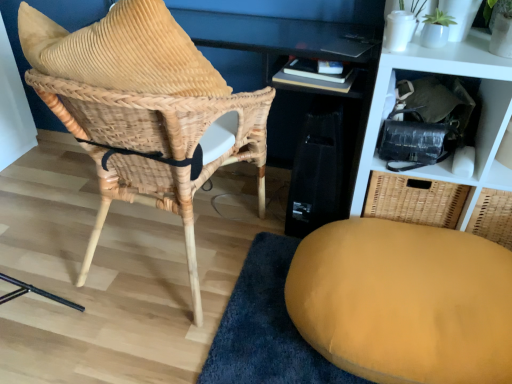
This screenshot has width=512, height=384. What are the coordinates of `woven wicker basket at upper right` in the screenshot? It's located at (479, 121).

What do you see at coordinates (145, 111) in the screenshot? I see `woven rattan chair at left` at bounding box center [145, 111].

Find the location of a particular element. velvet yellow ottoman at lower right is located at coordinates (404, 302).

Which object is further away from the camera, woven rattan chair at left or velvet yellow ottoman at lower right?

velvet yellow ottoman at lower right.

Identify the location of swivel chair below the woven rattan chair at left (from the image's perspective). The width and height of the screenshot is (512, 384). (404, 302).

Is point (91, 258) less distant than point (487, 253)?

No, it is not.

From a real-world perspective, is woven rattan chair at left over velvet yellow ottoman at lower right?

Correct, in the physical world, woven rattan chair at left is higher than velvet yellow ottoman at lower right.

From a real-world perspective, is velvet yellow ottoman at lower right under woven rattan chair at left?

Indeed, from a real-world perspective, velvet yellow ottoman at lower right is positioned beneath woven rattan chair at left.

Does velvet yellow ottoman at lower right appear on the left side of woven rattan chair at left?

Incorrect, velvet yellow ottoman at lower right is not on the left side of woven rattan chair at left.

From the picture: What's the angular difference between velvet yellow ottoman at lower right and woven rattan chair at left's facing directions?

There is a 97.7-degree angle between the facing directions of velvet yellow ottoman at lower right and woven rattan chair at left.

Are velvet yellow ottoman at lower right and woven rattan chair at left far apart?

Actually, velvet yellow ottoman at lower right and woven rattan chair at left are a little close together.

Is woven wicker basket at upper right with woven rattan chair at left?

No, woven wicker basket at upper right is not making contact with woven rattan chair at left.

Can you confirm if woven wicker basket at upper right is positioned to the left of woven rattan chair at left?

In fact, woven wicker basket at upper right is to the right of woven rattan chair at left.

Which of these two, woven wicker basket at upper right or woven rattan chair at left, is wider?

woven rattan chair at left.

Consider the image. Which of these two, woven wicker basket at upper right or woven rattan chair at left, is bigger?

woven rattan chair at left is bigger.

Is woven wicker basket at upper right in contact with velvet yellow ottoman at lower right?

No, woven wicker basket at upper right is not in contact with velvet yellow ottoman at lower right.

Which object is closer to the camera taking this photo, woven wicker basket at upper right or velvet yellow ottoman at lower right?

velvet yellow ottoman at lower right is more forward.

From the picture: Is woven wicker basket at upper right wider than velvet yellow ottoman at lower right?

No.

Considering the positions of objects velvet yellow ottoman at lower right and woven wicker basket at upper right in the image provided, who is in front, velvet yellow ottoman at lower right or woven wicker basket at upper right?

velvet yellow ottoman at lower right is in front.

Which of these two, velvet yellow ottoman at lower right or woven wicker basket at upper right, is wider?

velvet yellow ottoman at lower right is wider.

From the image's perspective, is velvet yellow ottoman at lower right located above or below woven wicker basket at upper right?

velvet yellow ottoman at lower right is below woven wicker basket at upper right.

Does point (408, 367) come farther from viewer compared to point (502, 64)?

No.

Is woven rattan chair at left taller or shorter than woven wicker basket at upper right?

Considering their sizes, woven rattan chair at left has more height than woven wicker basket at upper right.

Who is smaller, woven rattan chair at left or woven wicker basket at upper right?

woven wicker basket at upper right is smaller.

Measure the distance between woven rattan chair at left and woven wicker basket at upper right.

25.14 inches.

Between woven rattan chair at left and woven wicker basket at upper right, which one has larger width?

woven rattan chair at left is wider.

What are the coordinates of `chair above the velvet yellow ottoman at lower right (from the image's perspective)` in the screenshot? It's located at (145, 111).

Identify the location of swivel chair on the right side of woven rattan chair at left. (404, 302).

From the picture: From the image, which object appears to be farther from velvet yellow ottoman at lower right, woven rattan chair at left or woven wicker basket at upper right?

woven rattan chair at left is positioned further to the anchor velvet yellow ottoman at lower right.

Estimate the real-world distances between objects in this image. Which object is further from woven rattan chair at left, woven wicker basket at upper right or velvet yellow ottoman at lower right?

Among the two, woven wicker basket at upper right is located further to woven rattan chair at left.

From the image, which object appears to be nearer to velvet yellow ottoman at lower right, woven wicker basket at upper right or woven rattan chair at left?

Based on the image, woven wicker basket at upper right appears to be nearer to velvet yellow ottoman at lower right.

Estimate the real-world distances between objects in this image. Which object is further from woven wicker basket at upper right, woven rattan chair at left or velvet yellow ottoman at lower right?

woven rattan chair at left is further to woven wicker basket at upper right.

When comparing their distances from woven rattan chair at left, does velvet yellow ottoman at lower right or woven wicker basket at upper right seem further?

Among the two, woven wicker basket at upper right is located further to woven rattan chair at left.

Considering their positions, is velvet yellow ottoman at lower right positioned closer to woven wicker basket at upper right than woven rattan chair at left?

The object closer to woven wicker basket at upper right is velvet yellow ottoman at lower right.

The height and width of the screenshot is (384, 512). I want to click on swivel chair located between woven rattan chair at left and woven wicker basket at upper right in the left-right direction, so click(404, 302).